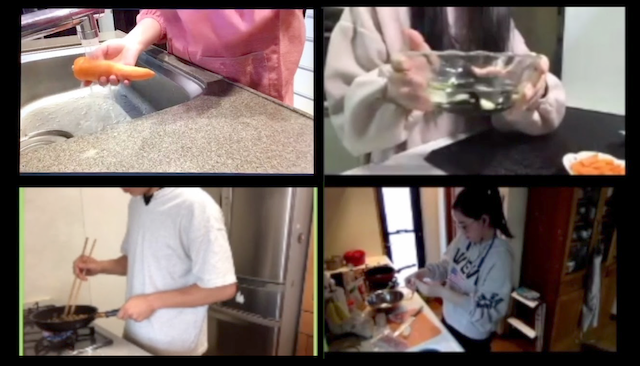
This screenshot has width=640, height=366. Find the location of `chopsticks`. chopsticks is located at coordinates (76, 296), (68, 292).